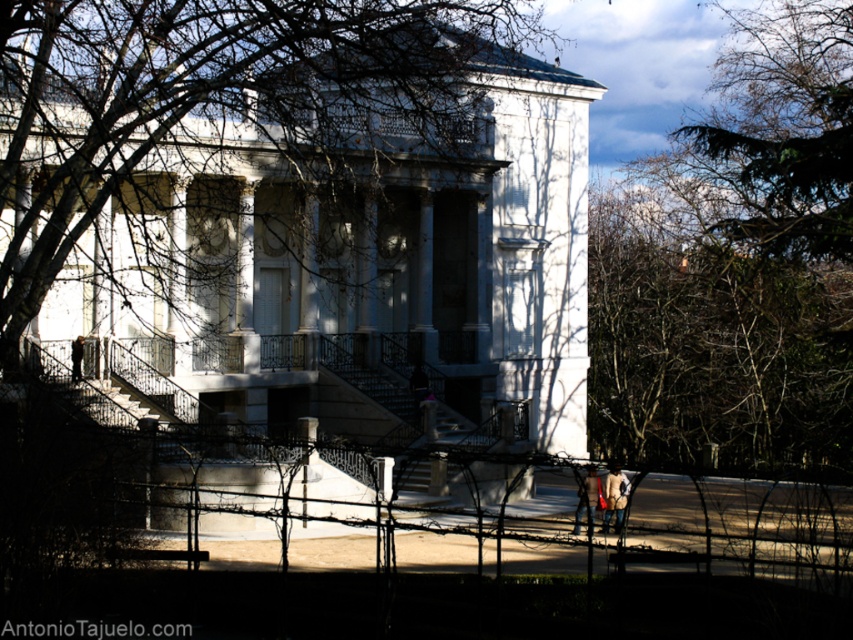
Which is above, bare branches at center or black wrought iron fence at lower center?

Positioned higher is bare branches at center.

Does bare branches at center have a smaller size compared to black wrought iron fence at lower center?

Incorrect, bare branches at center is not smaller in size than black wrought iron fence at lower center.

Between point (485, 12) and point (679, 508), which one is positioned behind?

Positioned behind is point (485, 12).

Image resolution: width=853 pixels, height=640 pixels. I want to click on bare branches at center, so click(x=223, y=99).

Does point (512, 515) lie in front of point (585, 481)?

No.

Does black wrought iron fence at lower center have a larger size compared to light brown leather jacket at center?

Indeed, black wrought iron fence at lower center has a larger size compared to light brown leather jacket at center.

Identify the location of black wrought iron fence at lower center. This screenshot has height=640, width=853. (747, 525).

Who is positioned more to the left, bare branches at center or leather jacket at lower right?

Positioned to the left is bare branches at center.

Is bare branches at center thinner than leather jacket at lower right?

No, bare branches at center is not thinner than leather jacket at lower right.

Find the location of a particular element. bare branches at center is located at coordinates (223, 99).